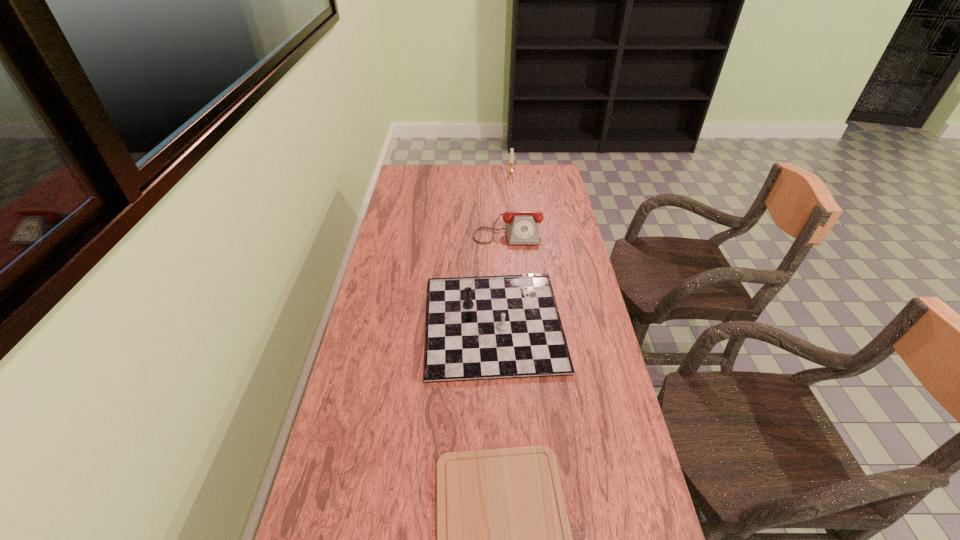
Select which object is the third closest to the second nearest object. Please provide its 2D coordinates. Your answer should be formatted as a tuple, i.e. [(x, y)], where the tuple contains the x and y coordinates of a point satisfying the conditions above.

[(511, 169)]